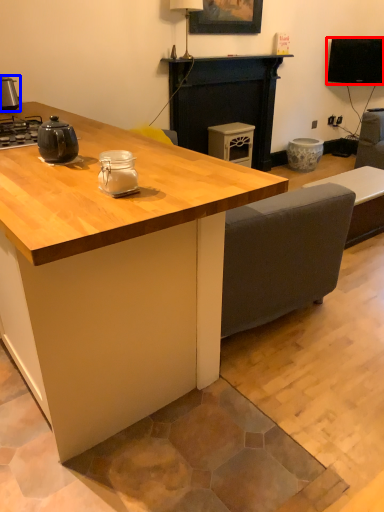
Question: Which of the following is the closest to the observer, television (highlighted by a red box) or appliance (highlighted by a blue box)?

Choices:
 (A) television
 (B) appliance

Answer: (B)